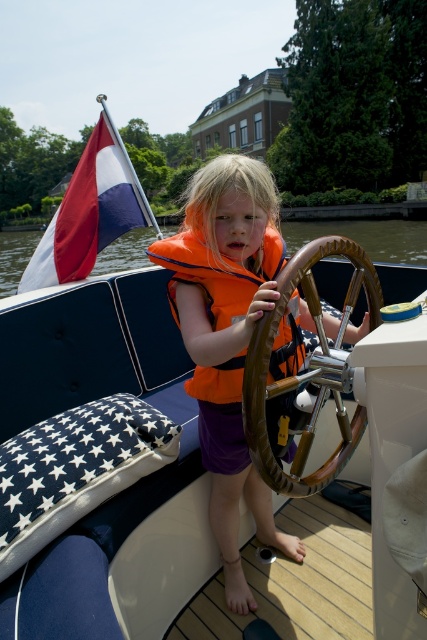
Question: Where is orange life vest at center located in relation to red-white-blue fabric flag at upper left in the image?

Choices:
 (A) left
 (B) right

Answer: (B)

Question: Which of the following is the closest to the observer?

Choices:
 (A) (108, 156)
 (B) (228, 305)
 (C) (350, 420)
 (D) (236, 218)

Answer: (B)

Question: Which point is closer to the camera?

Choices:
 (A) (263, 413)
 (B) (239, 307)
 (C) (245, 250)
 (D) (87, 221)

Answer: (A)

Question: Is red-white-blue fabric flag at upper left behind orange life jacket at center?

Choices:
 (A) no
 (B) yes

Answer: (B)

Question: Does brown leather steering wheel at center appear on the left side of red-white-blue fabric flag at upper left?

Choices:
 (A) yes
 (B) no

Answer: (B)

Question: Which of the following is the farthest from the observer?

Choices:
 (A) (x=231, y=284)
 (B) (x=75, y=266)
 (C) (x=272, y=252)
 (D) (x=271, y=333)

Answer: (B)